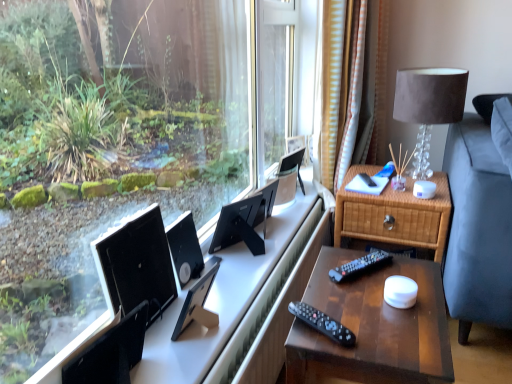
This screenshot has width=512, height=384. I want to click on unoccupied space behind black plastic remote control at lower center, which is counted as the 2th remote control, starting from the right, so click(326, 294).